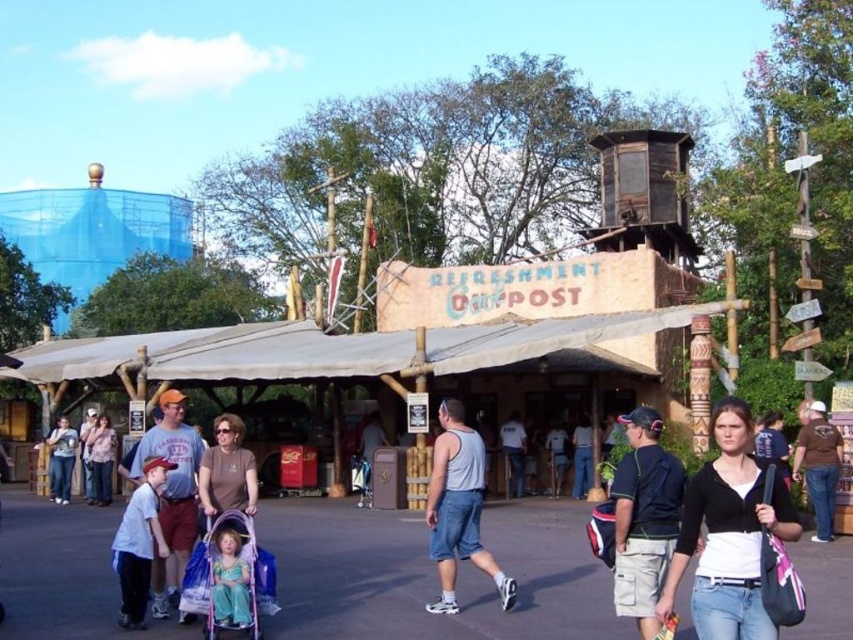
You are a photographer positioned at the front of the REFRESHMENT CAMP POST. You want to take a photo that includes both the purple fabric stroller at center and the light blue denim shorts at center. Which object should you adjust your focus on to ensure both are in the same focal plane?

To ensure both the purple fabric stroller at center and the light blue denim shorts at center are in the same focal plane, focus on the purple fabric stroller at center since it is closer to the viewer. This way, the light blue denim shorts at center, being farther away, will still be within the depth of field if the focus is set on the closer object.